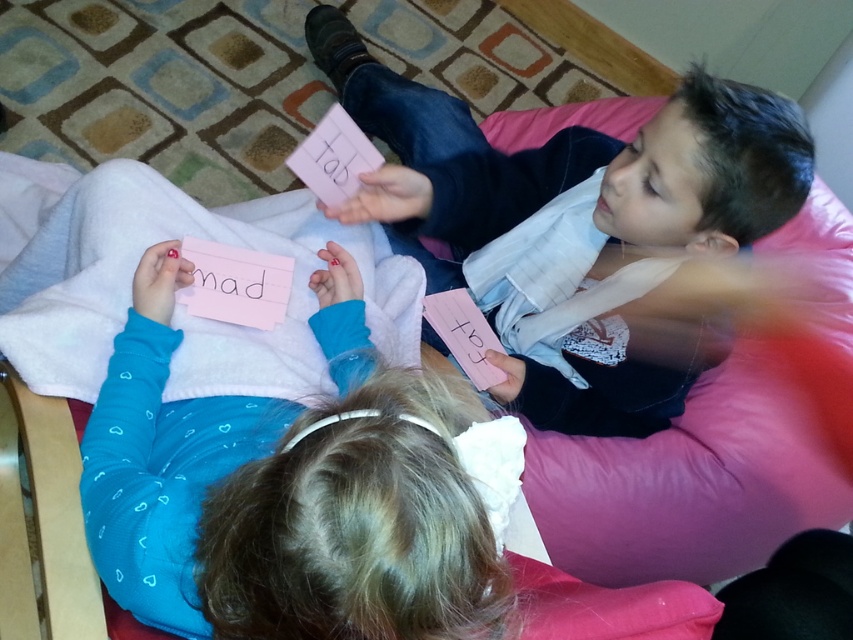
You are a teacher observing the children playing a card game. You notice a point in the scene at coordinates [287,490]. What object is located at this point?

The point at coordinates [287,490] corresponds to the pink paper card at center.

You are a child playing a game with your friend. You have a pink paper card at center in your hand and want to pass it to your friend holding the matte pink card at upper right. If your arm can reach 50 centimeters, can you pass the card without moving from your spot?

The distance between the pink paper card at center and the matte pink card at upper right is 47.63 centimeters. Since your arm can reach 50 centimeters, you can pass the card without moving from your spot.

You are a teacher observing two students playing a card game. You notice the pink paper card at center and the matte pink card at upper right. Which card is taller?

The matte pink card at upper right is taller than the pink paper card at center.